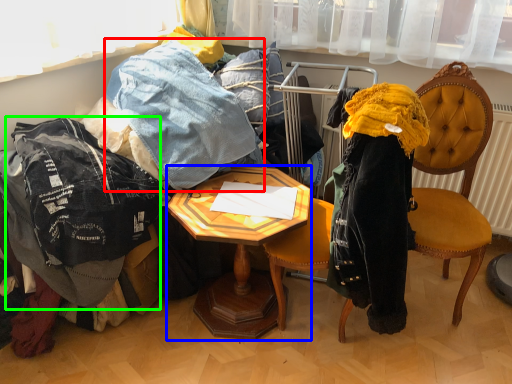
Question: Based on their relative distances, which object is nearer to trousers (highlighted by a red box)? Choose from desk (highlighted by a blue box) and clothing (highlighted by a green box).

Choices:
 (A) desk
 (B) clothing

Answer: (A)